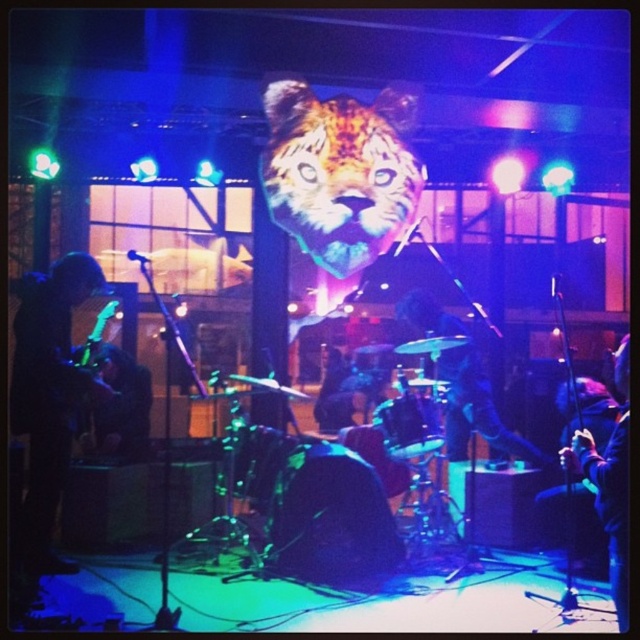
Question: Estimate the real-world distances between objects in this image. Which object is closer to the shiny black guitar at left?

Choices:
 (A) black matte drum at center
 (B) shiny orange tiger head at center
 (C) shiny metallic drum at center

Answer: (A)

Question: Is shiny orange tiger head at center thinner than smooth black drum at center?

Choices:
 (A) no
 (B) yes

Answer: (A)

Question: Where is shiny black guitar at left located in relation to shiny metallic drum at center in the image?

Choices:
 (A) left
 (B) right

Answer: (A)

Question: Which point is farther to the camera?

Choices:
 (A) shiny black guitar at lower right
 (B) smooth black drum at center

Answer: (B)

Question: Can you confirm if shiny black guitar at left is positioned to the left of smooth black drum at center?

Choices:
 (A) no
 (B) yes

Answer: (B)

Question: Considering the real-world distances, which object is closest to the shiny black guitar at lower right?

Choices:
 (A) shiny metallic drum at center
 (B) black matte drum at center
 (C) smooth black drum at center

Answer: (C)